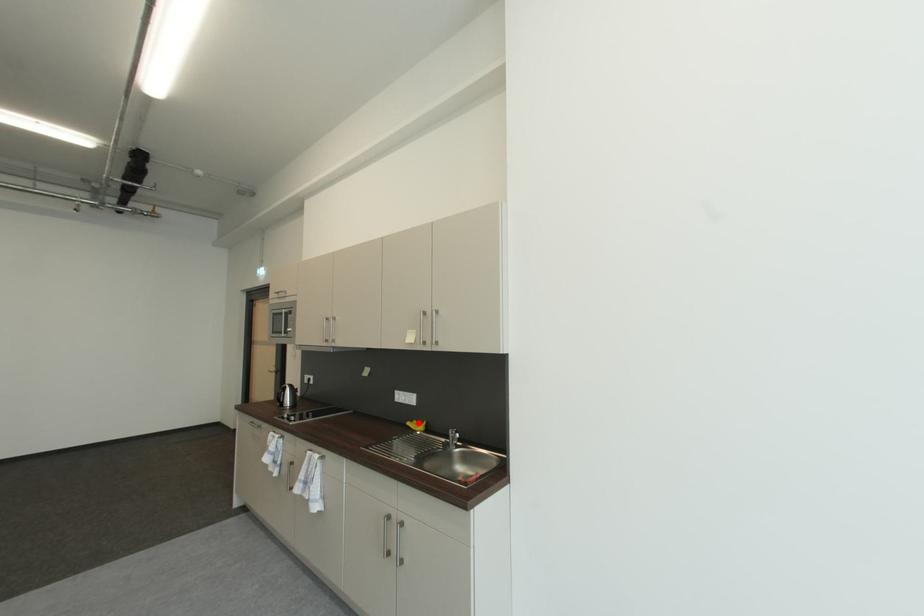
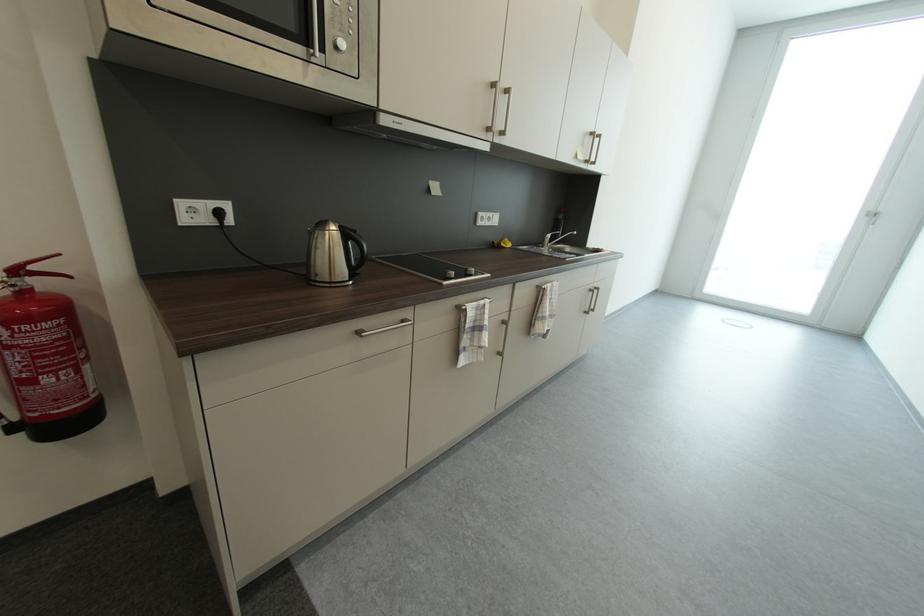
Question: I am providing you with two images of the same scene from different viewpoints. Given a red point in image1, look at the same physical point in image2. Is it:

Choices:
 (A) Closer to the viewpoint
 (B) Farther from the viewpoint

Answer: (A)